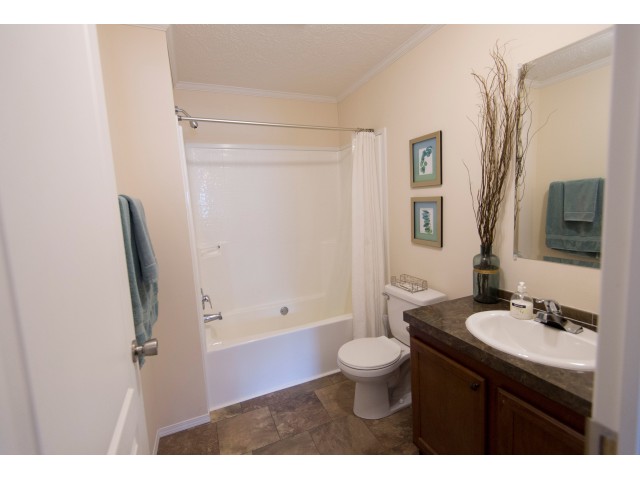
Find the location of `frame`. frame is located at coordinates (424, 148), (432, 214).